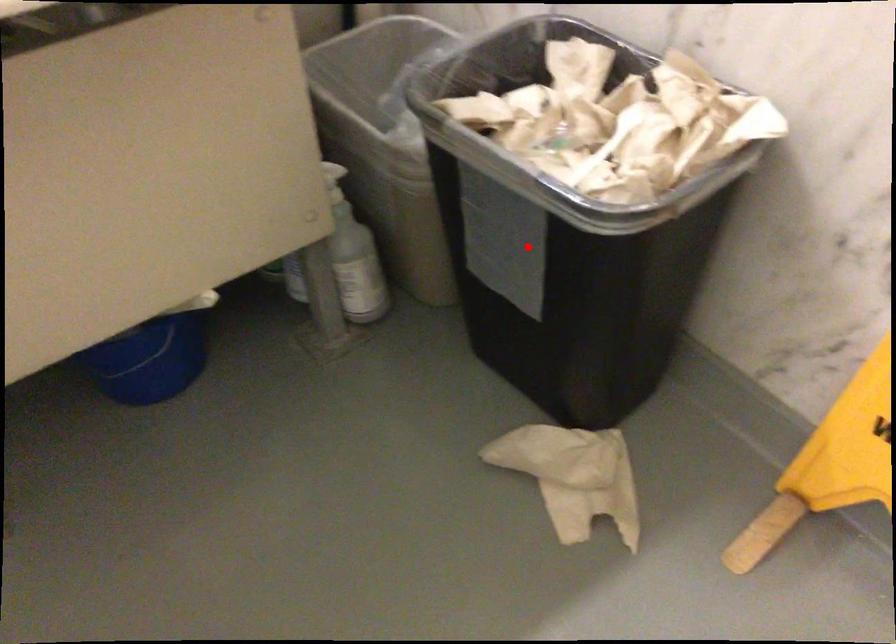
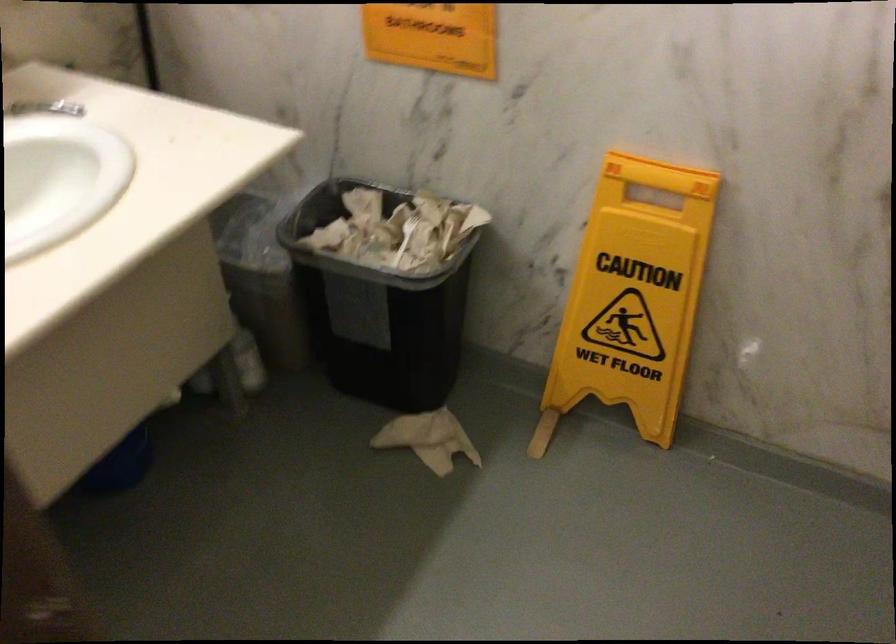
In the second image, find the point that corresponds to the highlighted location in the first image.

(376, 310)